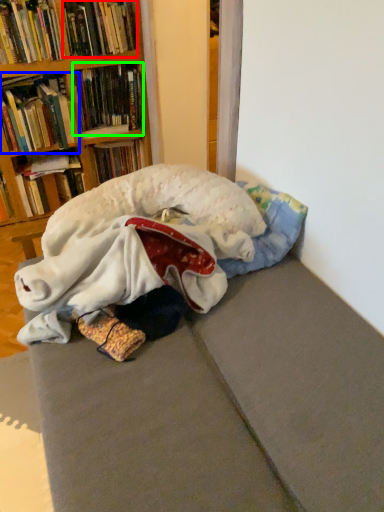
Question: Which object is the farthest from book (highlighted by a red box)? Choose among these: book (highlighted by a blue box) or book (highlighted by a green box).

Choices:
 (A) book
 (B) book

Answer: (A)